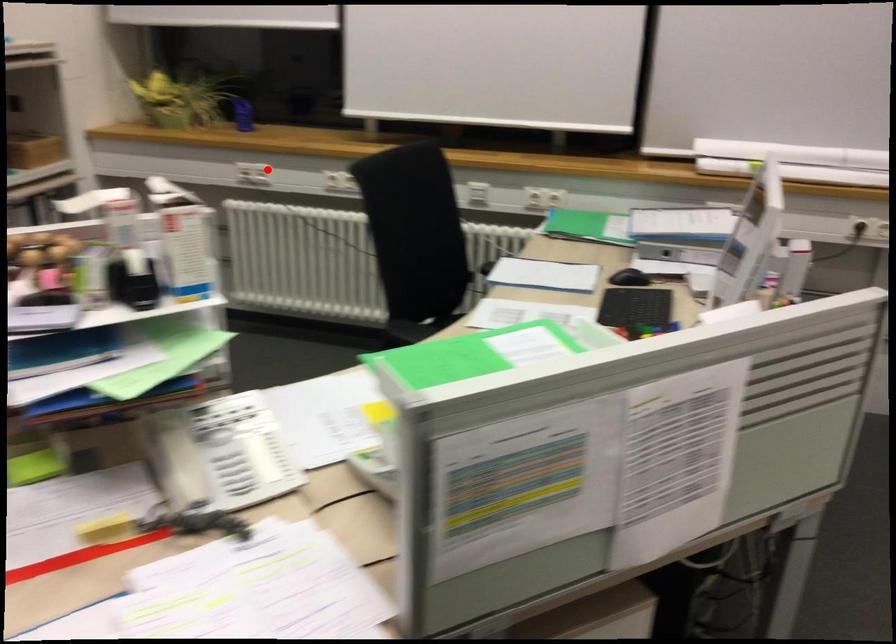
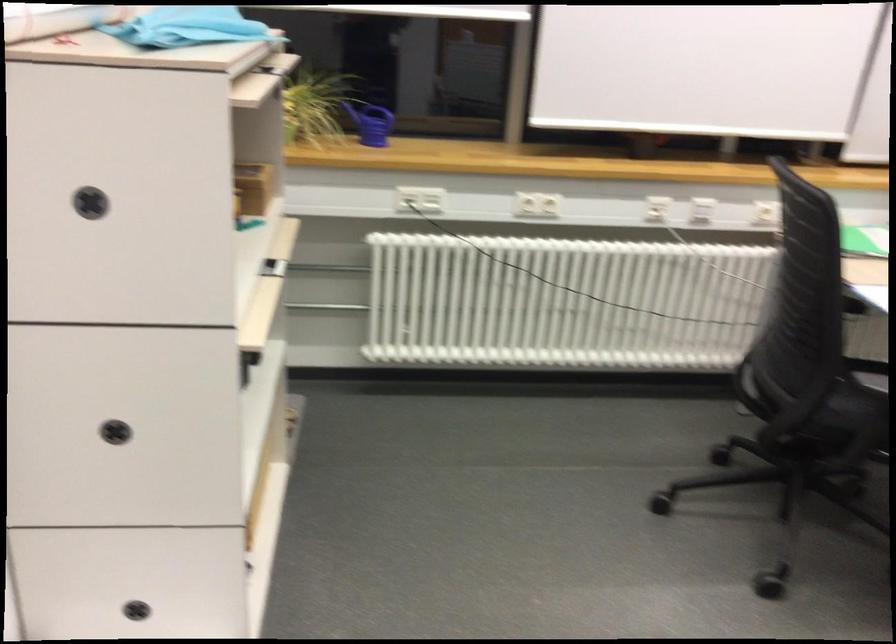
Question: A red point is marked in image1. In image2, is the corresponding 3D point closer to the camera or farther? Reply with the corresponding letter.

Choices:
 (A) The corresponding 3D point is closer.
 (B) The corresponding 3D point is farther.

Answer: (A)